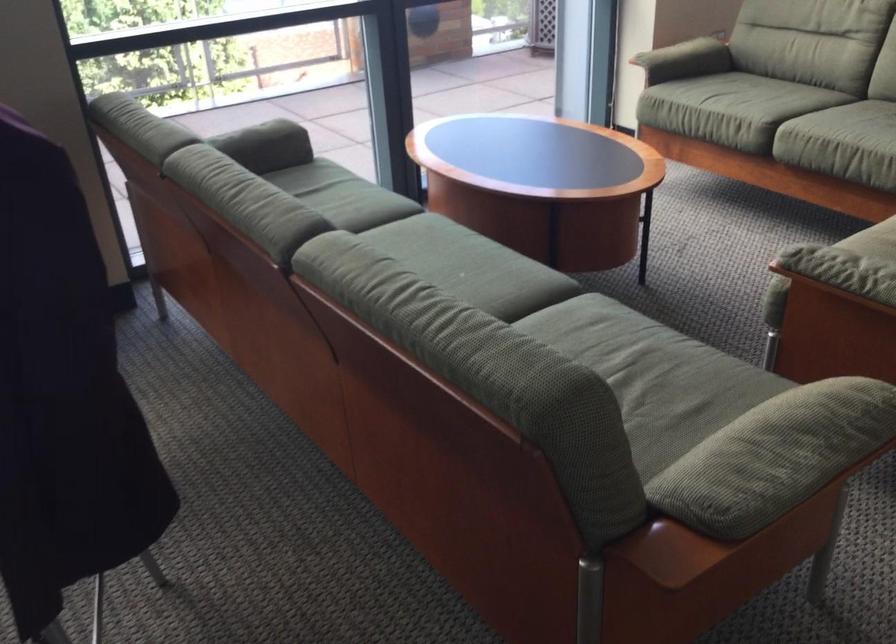
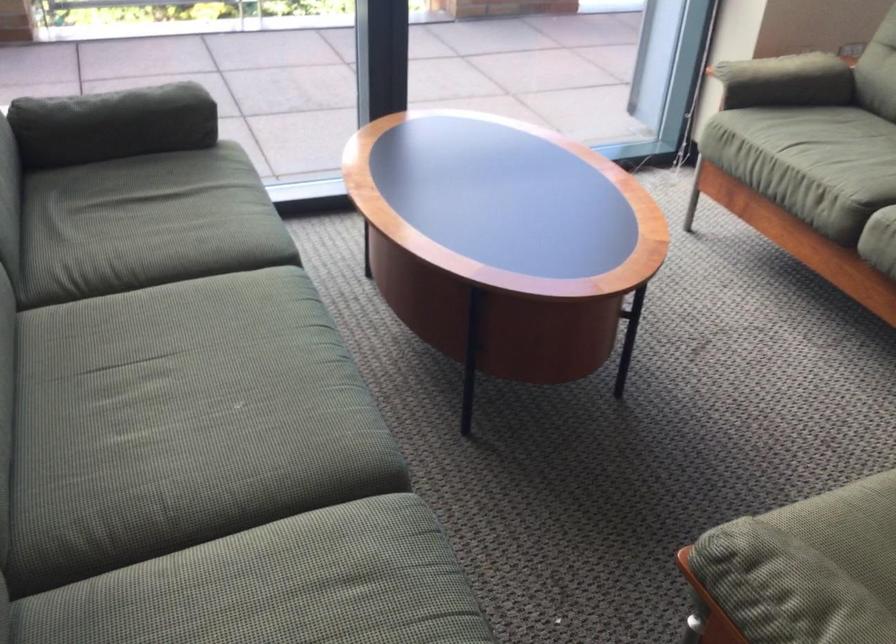
Where in the second image is the point corresponding to [755,102] from the first image?

(846, 180)